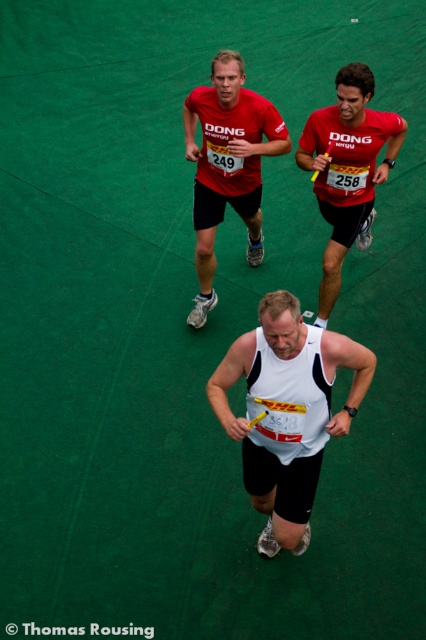
You are a photographer standing at the starting line of the race. You want to take a photo that includes both the point at (362, 397) and the point at (226, 109). Which point should you focus on first to ensure both are in sharp focus?

You should focus on point (226, 109) first because it is farther away from the viewer, and focusing on the farther point ensures the closer point (362, 397) will also be in focus due to depth of field.